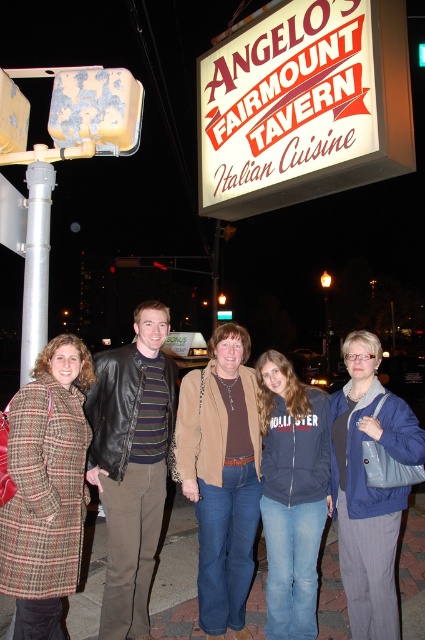
Question: Does plaid wool coat at lower left have a lesser width compared to brown suede jacket at center?

Choices:
 (A) yes
 (B) no

Answer: (A)

Question: Where is plaid wool coat at lower left located in relation to navy blue fleece at center in the image?

Choices:
 (A) right
 (B) left

Answer: (B)

Question: Which point is closer to the camera taking this photo?

Choices:
 (A) (272, 132)
 (B) (419, 436)
 (C) (317, 410)
 (D) (153, 376)

Answer: (B)

Question: Which is nearer to the plaid wool coat at lower left?

Choices:
 (A) leather jacket at center
 (B) blue fabric jacket at lower right

Answer: (A)

Question: Is leather jacket at center bigger than navy blue fleece at center?

Choices:
 (A) yes
 (B) no

Answer: (A)

Question: Among these points, which one is farthest from the camera?

Choices:
 (A) (33, 433)
 (B) (353, 116)
 (C) (265, 380)
 (D) (129, 577)

Answer: (C)